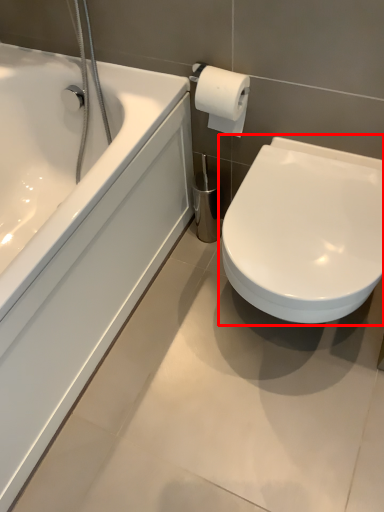
Question: From the image's perspective, what is the correct spatial relationship of toilet (annotated by the red box) in relation to bathtub?

Choices:
 (A) above
 (B) below

Answer: (B)